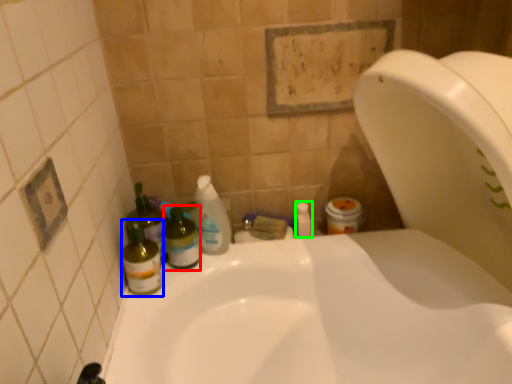
Question: Which object is the farthest from bottle (highlighted by a red box)? Choose among these: bottle (highlighted by a blue box) or mouthwash (highlighted by a green box).

Choices:
 (A) bottle
 (B) mouthwash

Answer: (B)